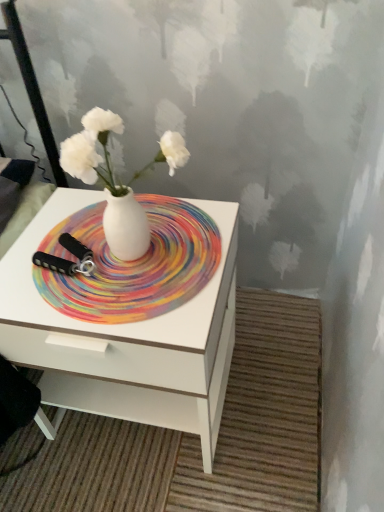
This screenshot has width=384, height=512. I want to click on free area behind white glossy vase at center, so click(x=143, y=208).